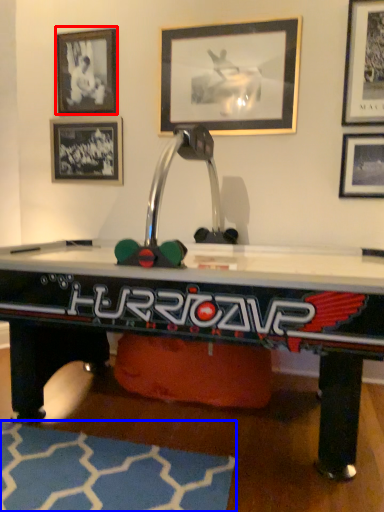
Question: Among these objects, which one is nearest to the camera, picture frame (highlighted by a red box) or mat (highlighted by a blue box)?

Choices:
 (A) picture frame
 (B) mat

Answer: (B)